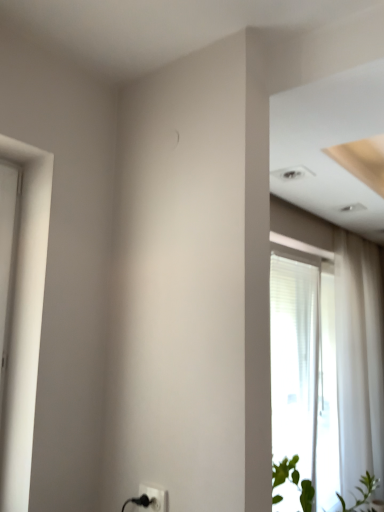
Question: Is green leafy plant at lower right not within transparent glass window at right?

Choices:
 (A) yes
 (B) no

Answer: (A)

Question: Is green leafy plant at lower right directly adjacent to transparent glass window at right?

Choices:
 (A) yes
 (B) no

Answer: (B)

Question: Is green leafy plant at lower right wider than transparent glass window at right?

Choices:
 (A) yes
 (B) no

Answer: (A)

Question: Considering the relative sizes of green leafy plant at lower right and transparent glass window at right in the image provided, is green leafy plant at lower right thinner than transparent glass window at right?

Choices:
 (A) no
 (B) yes

Answer: (A)

Question: From a real-world perspective, is green leafy plant at lower right on top of transparent glass window at right?

Choices:
 (A) yes
 (B) no

Answer: (B)

Question: From a real-world perspective, is green leafy plant at lower right under transparent glass window at right?

Choices:
 (A) no
 (B) yes

Answer: (B)

Question: Is white sheer curtain at right bigger than green leafy plant at lower right?

Choices:
 (A) no
 (B) yes

Answer: (B)

Question: From the image's perspective, would you say white sheer curtain at right is positioned over green leafy plant at lower right?

Choices:
 (A) yes
 (B) no

Answer: (A)

Question: Is white sheer curtain at right far away from green leafy plant at lower right?

Choices:
 (A) yes
 (B) no

Answer: (A)

Question: Can you confirm if white sheer curtain at right is shorter than green leafy plant at lower right?

Choices:
 (A) yes
 (B) no

Answer: (B)

Question: Considering the relative sizes of white sheer curtain at right and green leafy plant at lower right in the image provided, is white sheer curtain at right taller than green leafy plant at lower right?

Choices:
 (A) yes
 (B) no

Answer: (A)

Question: Is green leafy plant at lower right at the back of white sheer curtain at right?

Choices:
 (A) no
 (B) yes

Answer: (A)

Question: Can you confirm if transparent glass window at right is bigger than black plastic electric outlet at lower center?

Choices:
 (A) yes
 (B) no

Answer: (A)